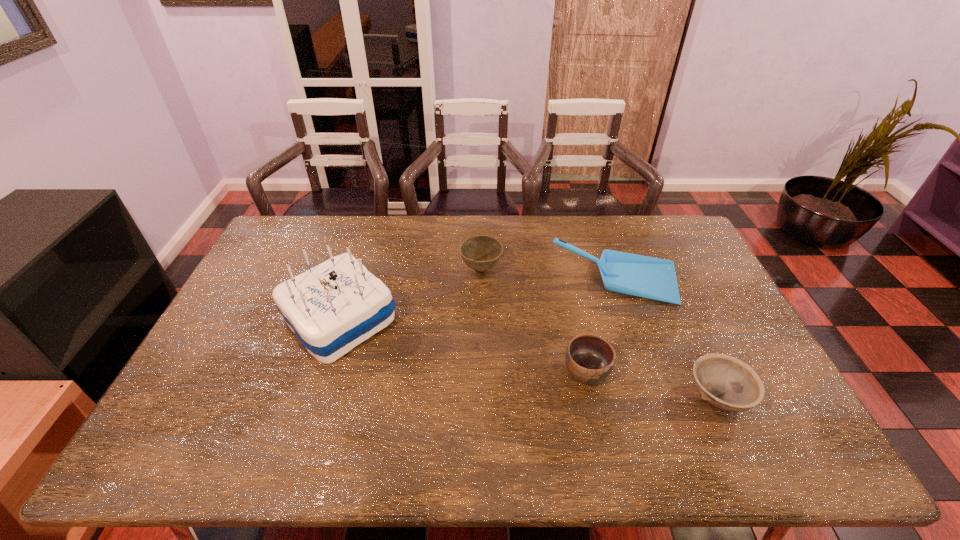
The height and width of the screenshot is (540, 960). Find the location of `vacant area located on the right of the second bowl from left to right`. vacant area located on the right of the second bowl from left to right is located at coordinates (710, 372).

Find the location of a particular element. free region located on the back of the rightmost bowl is located at coordinates (691, 339).

You are a GUI agent. You are given a task and a screenshot of the screen. Output one action in this format:
    pyautogui.click(x=<x>, y=<y>)
    Task: Click on the dustpan located in the right edge section of the desktop
    This screenshot has height=540, width=960.
    Given the screenshot: What is the action you would take?
    pyautogui.click(x=648, y=277)

Where is `bowl located in the right edge section of the desktop`? bowl located in the right edge section of the desktop is located at coordinates (725, 382).

The width and height of the screenshot is (960, 540). I want to click on vacant space at the far edge, so click(564, 221).

The image size is (960, 540). In the image, there is a desktop. Find the location of `vacant space at the near edge`. vacant space at the near edge is located at coordinates (505, 433).

This screenshot has height=540, width=960. I want to click on vacant space at the left edge, so click(269, 295).

This screenshot has width=960, height=540. In the image, there is a desktop. What are the coordinates of `vacant area at the right edge` in the screenshot? It's located at (677, 277).

This screenshot has width=960, height=540. I want to click on vacant space at the far left corner, so click(x=287, y=244).

Locate an element on the screen. The image size is (960, 540). unoccupied position between the rightmost bowl and the fourth shortest object is located at coordinates (667, 339).